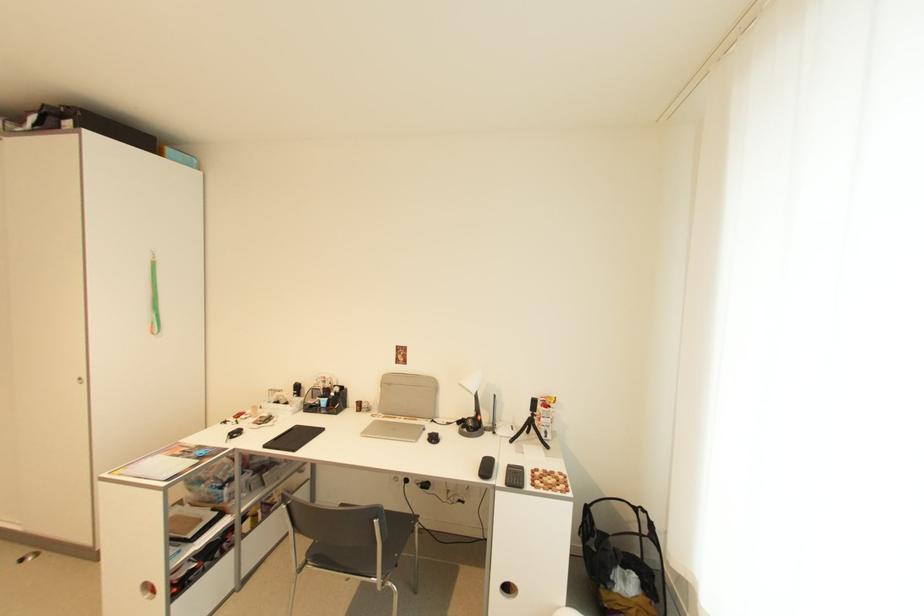
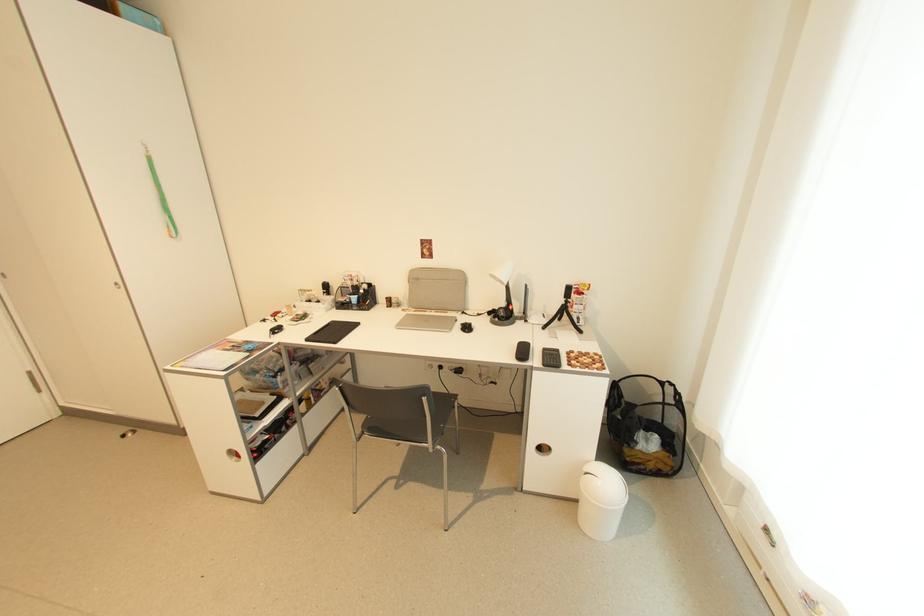
Find the pixel in the second image that matches point (538, 416) in the first image.

(572, 302)